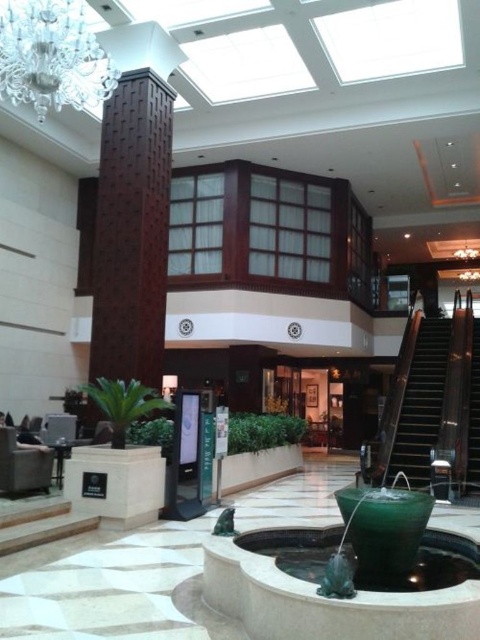
Does green glass bowl at center have a lesser width compared to metallic staircase at right?

Indeed, green glass bowl at center has a lesser width compared to metallic staircase at right.

Is green glass bowl at center wider than metallic staircase at right?

No.

Describe the element at coordinates (384, 528) in the screenshot. This screenshot has width=480, height=640. I see `green glass bowl at center` at that location.

At what (x,y) coordinates should I click in order to perform the action: click on green glass bowl at center. Please return your answer as a coordinate pair (x, y). Looking at the image, I should click on (384, 528).

Is crystal glass chandelier at upper left further to the viewer compared to brown wooden stairs at right?

No, it is not.

Image resolution: width=480 pixels, height=640 pixels. Describe the element at coordinates (51, 56) in the screenshot. I see `crystal glass chandelier at upper left` at that location.

This screenshot has width=480, height=640. Find the location of `crystal glass chandelier at upper left`. crystal glass chandelier at upper left is located at coordinates (51, 56).

Where is `crystal glass chandelier at upper left`? crystal glass chandelier at upper left is located at coordinates (51, 56).

Is point (458, 600) less distant than point (444, 339)?

Yes, it is.

Between point (228, 609) and point (432, 320), which one is positioned in front?

Point (228, 609) is more forward.

Image resolution: width=480 pixels, height=640 pixels. Find the location of `green marble fountain at center`. green marble fountain at center is located at coordinates (374, 522).